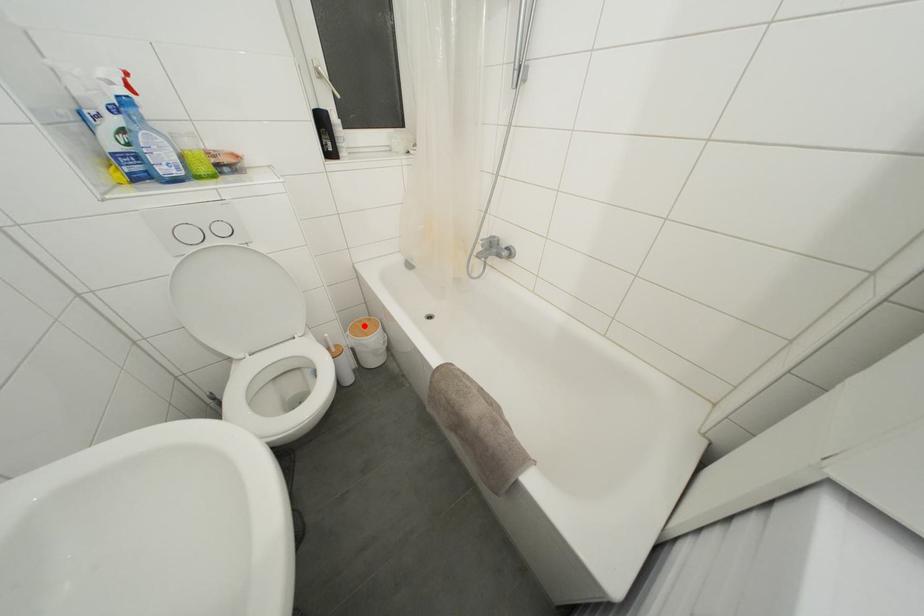
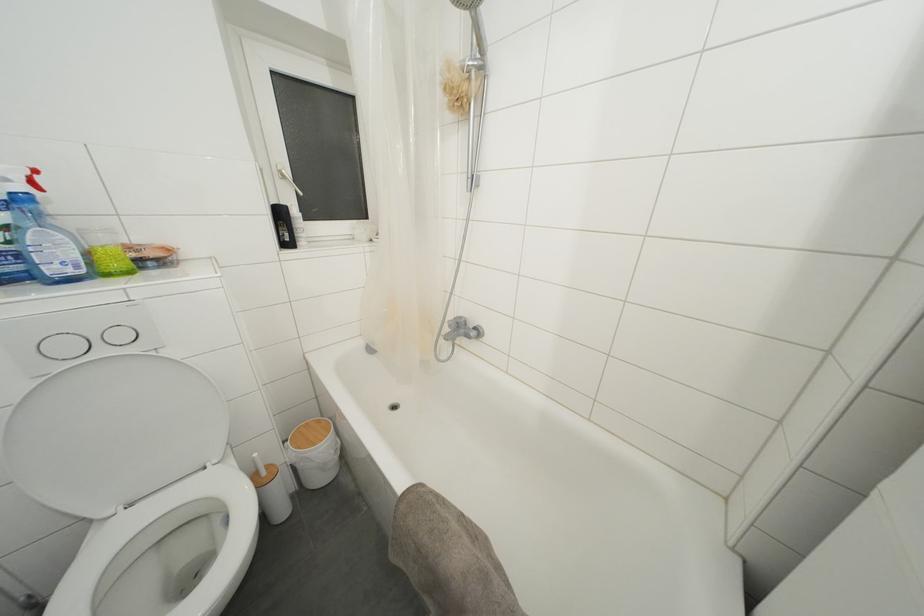
Question: I am providing you with two images of the same scene from different viewpoints. Image1 has a red point marked. In image2, the corresponding 3D location appears at what relative position? Reply with the corresponding letter.

Choices:
 (A) Closer
 (B) Farther

Answer: (B)